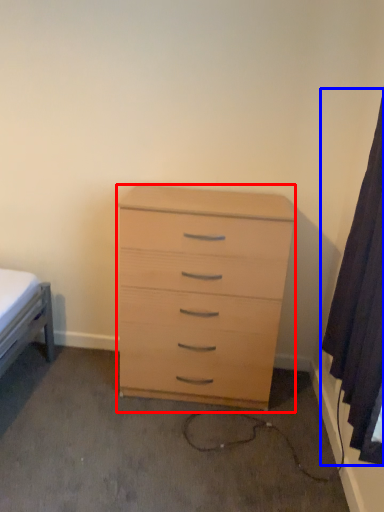
Question: Which point is further to the camera, chest of drawers (highlighted by a red box) or curtain (highlighted by a blue box)?

Choices:
 (A) chest of drawers
 (B) curtain

Answer: (A)